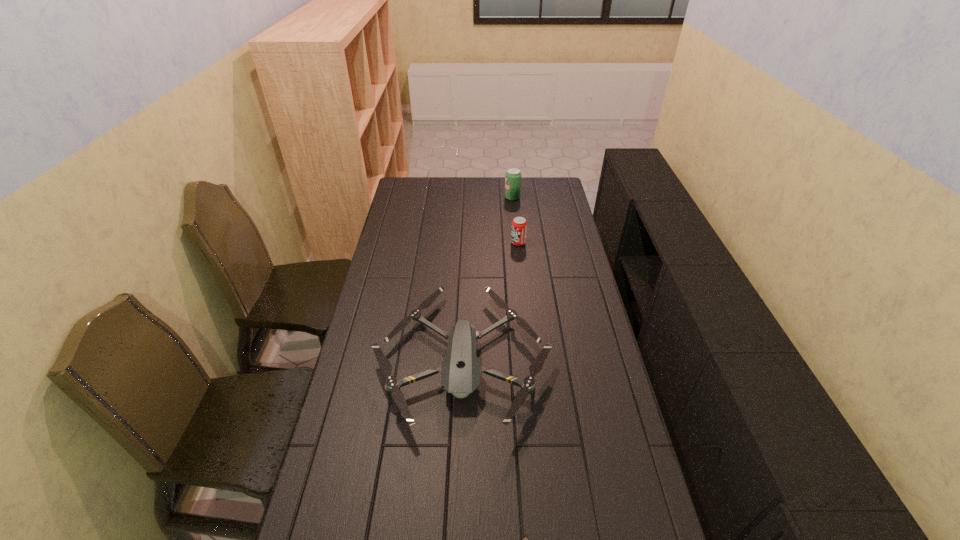
Locate an element on the screen. The width and height of the screenshot is (960, 540). the farther soda can is located at coordinates (513, 175).

Locate an element on the screen. the farthest object is located at coordinates (513, 175).

Find the location of a particular element. This screenshot has height=540, width=960. the nearer soda can is located at coordinates coord(519,225).

Image resolution: width=960 pixels, height=540 pixels. What are the coordinates of `the second tallest object` in the screenshot? It's located at (519, 225).

Image resolution: width=960 pixels, height=540 pixels. Find the location of `drone`. drone is located at coordinates (460, 370).

Where is `the second shortest object`? This screenshot has height=540, width=960. the second shortest object is located at coordinates (460, 370).

Locate an element on the screen. vacant space situated 0.170m on the right of the farthest object is located at coordinates (554, 198).

Locate an element on the screen. vacant region located 0.250m on the surface of the third shortest object is located at coordinates (454, 243).

You are a GUI agent. You are given a task and a screenshot of the screen. Output one action in this format:
    pyautogui.click(x=<x>, y=<y>)
    Task: Click on the blank space located 0.050m on the surface of the third shortest object
    The height and width of the screenshot is (540, 960).
    Given the screenshot: What is the action you would take?
    pyautogui.click(x=499, y=243)

At what (x,y) coordinates should I click in order to perform the action: click on vacant space located on the surface of the third shortest object. Please return your answer as a coordinate pair (x, y). The width and height of the screenshot is (960, 540). Looking at the image, I should click on (464, 243).